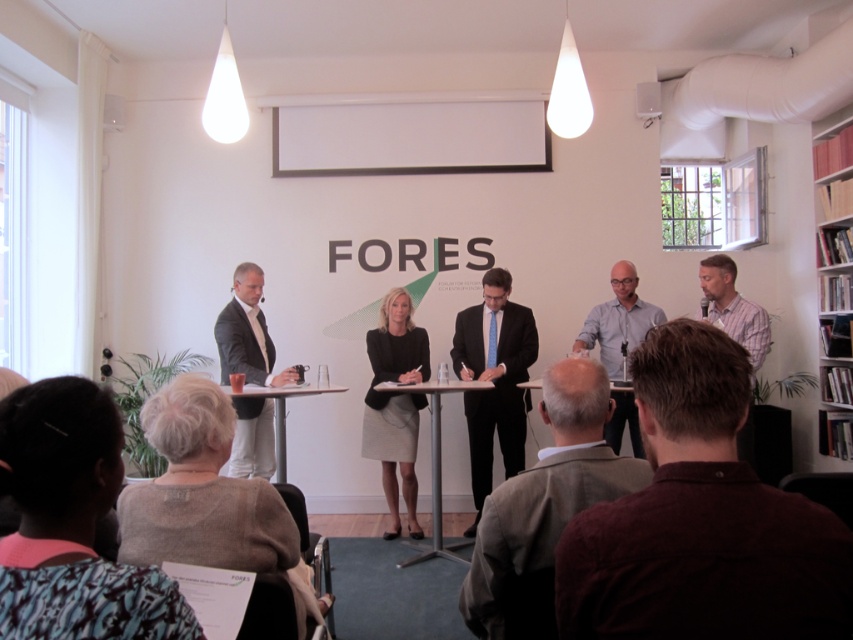
Question: Is dark blue suit at center further to the viewer compared to metallic silver table at center?

Choices:
 (A) no
 (B) yes

Answer: (B)

Question: Is gray wool jacket at center below metallic silver table at center?

Choices:
 (A) no
 (B) yes

Answer: (A)

Question: Which point is farther to the camera?

Choices:
 (A) (733, 307)
 (B) (529, 406)
 (C) (383, 381)

Answer: (B)

Question: Which point is closer to the camera?

Choices:
 (A) (250, 317)
 (B) (283, 436)
 (C) (732, 289)
 (D) (434, 515)

Answer: (D)

Question: Can you confirm if dark blue suit at center is smaller than light gray suit at left?

Choices:
 (A) yes
 (B) no

Answer: (A)

Question: Among these points, which one is nearest to the camera?

Choices:
 (A) (270, 497)
 (B) (648, 307)

Answer: (A)